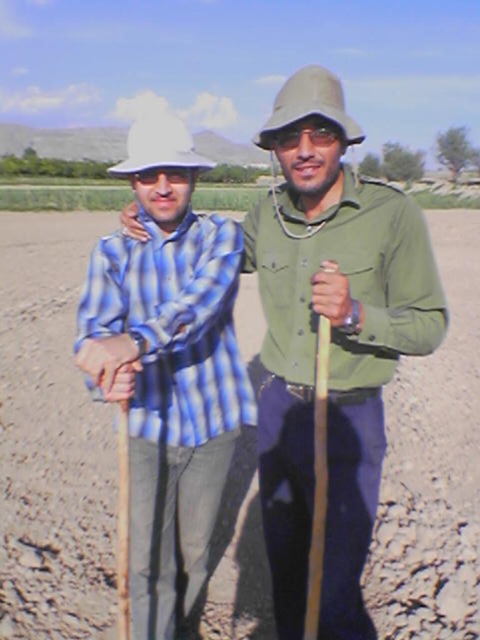
Can you confirm if blue striped shirt at left is positioned below white matte hat at center?

→ Yes, blue striped shirt at left is below white matte hat at center.

Does blue striped shirt at left have a smaller size compared to white matte hat at center?

Correct, blue striped shirt at left occupies less space than white matte hat at center.

You are a GUI agent. You are given a task and a screenshot of the screen. Output one action in this format:
    pyautogui.click(x=<x>, y=<y>)
    Task: Click on the blue striped shirt at left
    
    Given the screenshot: What is the action you would take?
    pyautogui.click(x=168, y=368)

Is blue striped shirt at left closer to camera compared to green matte pith helmet at upper center?

Yes, it is.

This screenshot has width=480, height=640. Describe the element at coordinates (168, 368) in the screenshot. I see `blue striped shirt at left` at that location.

At what (x,y) coordinates should I click in order to perform the action: click on blue striped shirt at left. Please return your answer as a coordinate pair (x, y). Looking at the image, I should click on (168, 368).

The width and height of the screenshot is (480, 640). In order to click on brown dirt track at center in this screenshot , I will do pos(50,438).

Which is more to the left, brown dirt track at center or green matte pith helmet at upper center?

brown dirt track at center

Between point (445, 522) and point (278, 128), which one is positioned in front?

Point (278, 128) is more forward.

Identify the location of brown dirt track at center. Image resolution: width=480 pixels, height=640 pixels. (50, 438).